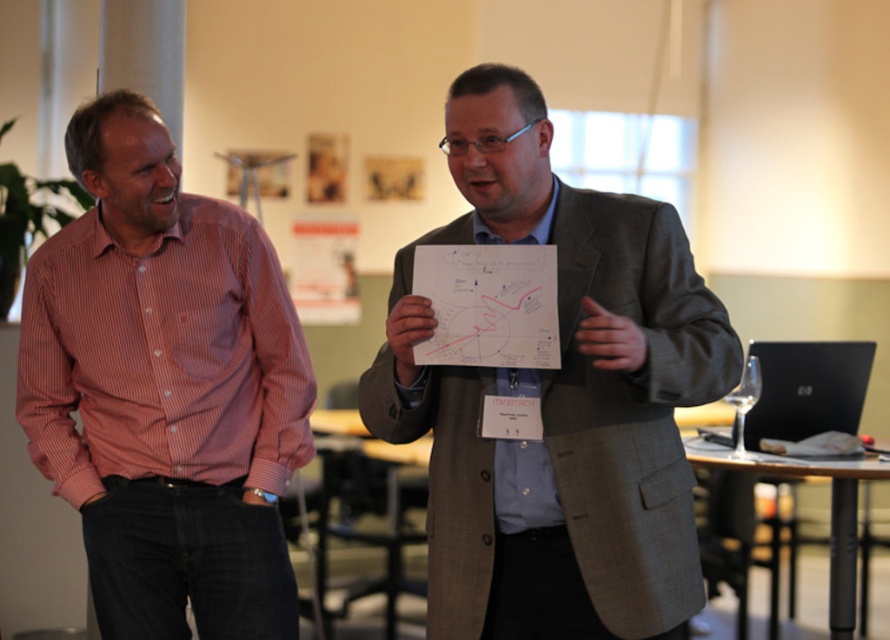
Question: Can you confirm if matte pink shirt at left is wider than pink striped shirt at left?

Choices:
 (A) yes
 (B) no

Answer: (A)

Question: Where is matte pink shirt at left located in relation to pink striped shirt at left in the image?

Choices:
 (A) above
 (B) below

Answer: (A)

Question: Which object appears closest to the camera in this image?

Choices:
 (A) pink striped shirt at left
 (B) matte pink shirt at left

Answer: (B)

Question: Is matte pink shirt at left smaller than pink striped shirt at left?

Choices:
 (A) no
 (B) yes

Answer: (A)

Question: Among these points, which one is nearest to the camera?

Choices:
 (A) (160, 636)
 (B) (668, 576)

Answer: (B)